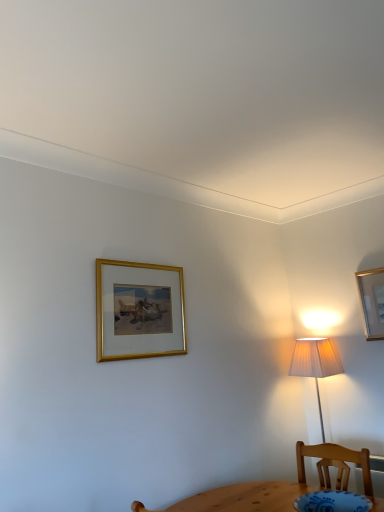
Question: Would you say metallic gold picture frame at upper right, which is counted as the 1th picture frame, starting from the right, is inside or outside gold-framed painting at upper center, positioned as the first picture frame in front-to-back order?

Choices:
 (A) outside
 (B) inside

Answer: (A)

Question: In terms of height, does metallic gold picture frame at upper right, which appears as the 1th picture frame when viewed from the back, look taller or shorter compared to gold-framed painting at upper center, positioned as the first picture frame in front-to-back order?

Choices:
 (A) short
 (B) tall

Answer: (A)

Question: From a real-world perspective, relative to gold-framed painting at upper center, which is counted as the 2th picture frame, starting from the right, is metallic gold picture frame at upper right, positioned as the 2th picture frame in left-to-right order, vertically above or below?

Choices:
 (A) below
 (B) above

Answer: (A)

Question: Is gold-framed painting at upper center, positioned as the second picture frame in back-to-front order, wider or thinner than metallic gold picture frame at upper right, which appears as the 1th picture frame when viewed from the back?

Choices:
 (A) thin
 (B) wide

Answer: (B)

Question: Is point (162, 344) closer or farther from the camera than point (380, 297)?

Choices:
 (A) farther
 (B) closer

Answer: (B)

Question: Visually, is gold-framed painting at upper center, which is counted as the 2th picture frame, starting from the right, positioned to the left or to the right of metallic gold picture frame at upper right, positioned as the 2th picture frame in left-to-right order?

Choices:
 (A) right
 (B) left

Answer: (B)

Question: In terms of height, does gold-framed painting at upper center, which is the 1th picture frame in left-to-right order, look taller or shorter compared to metallic gold picture frame at upper right, which is counted as the 1th picture frame, starting from the right?

Choices:
 (A) short
 (B) tall

Answer: (B)